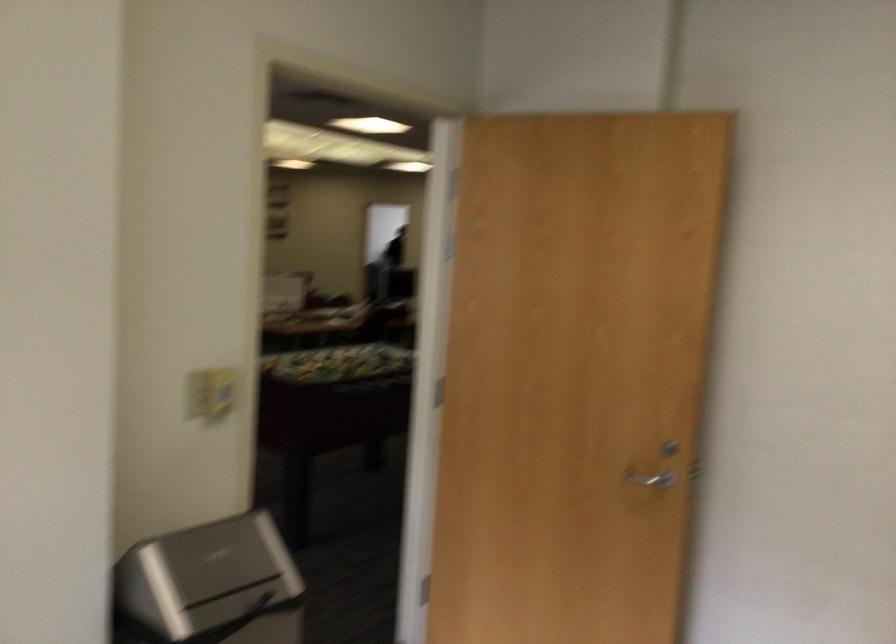
The first image is from the beginning of the video and the second image is from the end. How did the camera likely rotate when shooting the video?

The rotation direction of the camera is left-down.